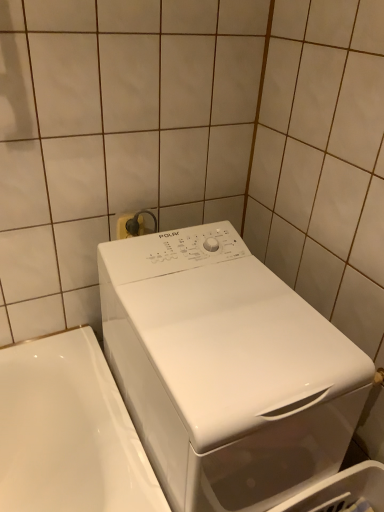
Question: Considering the positions of white plastic electric outlet at upper center and white glossy washing machine at center in the image, is white plastic electric outlet at upper center bigger or smaller than white glossy washing machine at center?

Choices:
 (A) big
 (B) small

Answer: (B)

Question: Is point (124, 234) closer or farther from the camera than point (215, 474)?

Choices:
 (A) closer
 (B) farther

Answer: (B)

Question: From the image's perspective, is white plastic electric outlet at upper center above or below white glossy washing machine at center?

Choices:
 (A) above
 (B) below

Answer: (A)

Question: Does point (147, 454) appear closer or farther from the camera than point (129, 218)?

Choices:
 (A) farther
 (B) closer

Answer: (B)

Question: Considering the positions of white glossy washing machine at center and white plastic electric outlet at upper center in the image, is white glossy washing machine at center wider or thinner than white plastic electric outlet at upper center?

Choices:
 (A) thin
 (B) wide

Answer: (B)

Question: Is white glossy washing machine at center inside the boundaries of white plastic electric outlet at upper center, or outside?

Choices:
 (A) outside
 (B) inside

Answer: (A)

Question: In terms of size, does white glossy washing machine at center appear bigger or smaller than white plastic electric outlet at upper center?

Choices:
 (A) big
 (B) small

Answer: (A)